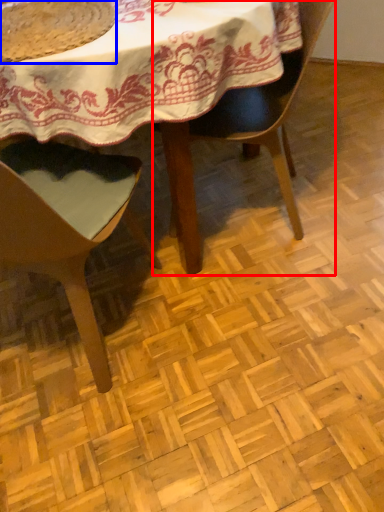
Question: Which object appears farthest to the camera in this image, chair (highlighted by a red box) or food (highlighted by a blue box)?

Choices:
 (A) chair
 (B) food

Answer: (A)